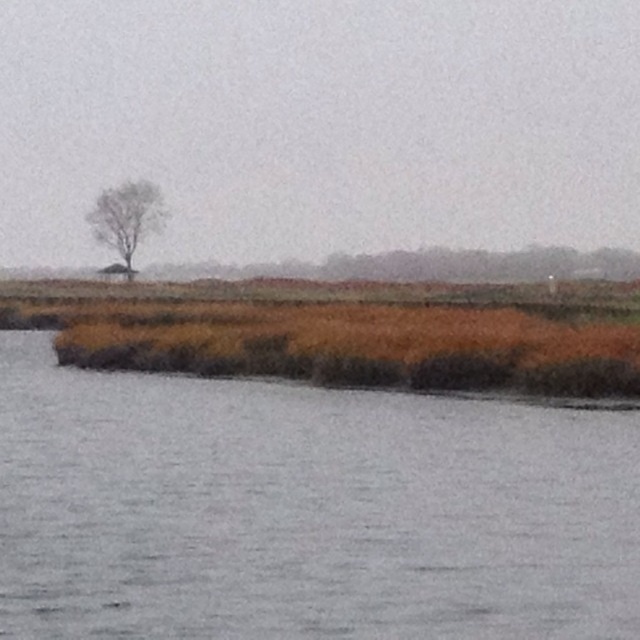
Question: Does gray matte water at lower left appear on the right side of bare branches tree at upper left?

Choices:
 (A) no
 (B) yes

Answer: (B)

Question: Does gray matte water at lower left have a greater width compared to bare branches tree at upper left?

Choices:
 (A) no
 (B) yes

Answer: (B)

Question: Can you confirm if gray matte water at lower left is smaller than bare branches tree at upper left?

Choices:
 (A) yes
 (B) no

Answer: (A)

Question: Which point is closer to the camera?

Choices:
 (A) (157, 508)
 (B) (113, 266)

Answer: (A)

Question: Which point is closer to the camera?

Choices:
 (A) bare branches tree at upper left
 (B) gray matte water at lower left

Answer: (B)